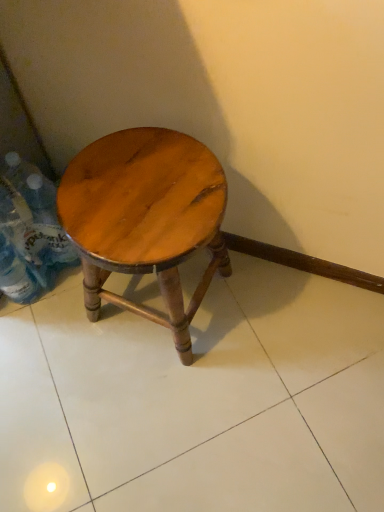
This screenshot has height=512, width=384. What do you see at coordinates (145, 218) in the screenshot? I see `wooden stool at center` at bounding box center [145, 218].

Locate an element on the screen. The width and height of the screenshot is (384, 512). wooden stool at center is located at coordinates (145, 218).

Image resolution: width=384 pixels, height=512 pixels. What do you see at coordinates (24, 234) in the screenshot? I see `translucent plastic bottle at left` at bounding box center [24, 234].

You are a GUI agent. You are given a task and a screenshot of the screen. Output one action in this format:
    pyautogui.click(x=<x>, y=<y>)
    Task: Click on the translucent plastic bottle at left
    Image resolution: width=384 pixels, height=512 pixels.
    Given the screenshot: What is the action you would take?
    pyautogui.click(x=24, y=234)

Measure the distance between translucent plastic bottle at left and camera.

translucent plastic bottle at left is 35.61 inches from camera.

Where is `wooden stool at center`? The width and height of the screenshot is (384, 512). wooden stool at center is located at coordinates (145, 218).

Is translucent plastic bottle at left to the right of wooden stool at center from the viewer's perspective?

Incorrect, translucent plastic bottle at left is not on the right side of wooden stool at center.

Which object is closer to the camera, translucent plastic bottle at left or wooden stool at center?

Positioned in front is wooden stool at center.

Does point (20, 224) come in front of point (116, 144)?

No.

Consider the image. From the image's perspective, is translucent plastic bottle at left above or below wooden stool at center?

translucent plastic bottle at left is above wooden stool at center.

Based on the photo, from a real-world perspective, which object stands above the other?

From a 3D spatial view, wooden stool at center is above.

Considering the sizes of objects translucent plastic bottle at left and wooden stool at center in the image provided, who is wider, translucent plastic bottle at left or wooden stool at center?

Wider between the two is wooden stool at center.

Between translucent plastic bottle at left and wooden stool at center, which one has less height?

Standing shorter between the two is translucent plastic bottle at left.

Can you confirm if translucent plastic bottle at left is smaller than wooden stool at center?

A: Indeed, translucent plastic bottle at left has a smaller size compared to wooden stool at center.

From the picture: Is translucent plastic bottle at left outside of wooden stool at center?

translucent plastic bottle at left lies outside wooden stool at center's area.

In the scene shown: Can you see translucent plastic bottle at left touching wooden stool at center?

translucent plastic bottle at left is not next to wooden stool at center, and they're not touching.

From the picture: Is wooden stool at center at the back of translucent plastic bottle at left?

No, wooden stool at center is not at the back of translucent plastic bottle at left.

The image size is (384, 512). What are the coordinates of `bottle to the left of wooden stool at center` in the screenshot? It's located at (24, 234).

Is wooden stool at center to the right of translucent plastic bottle at left from the viewer's perspective?

Indeed, wooden stool at center is positioned on the right side of translucent plastic bottle at left.

Is wooden stool at center closer to the viewer compared to translucent plastic bottle at left?

Yes, wooden stool at center is in front of translucent plastic bottle at left.

Does point (210, 216) come behind point (51, 284)?

No, it is in front of (51, 284).

From the image's perspective, which is below, wooden stool at center or translucent plastic bottle at left?

From the image's view, wooden stool at center is below.

From a real-world perspective, between wooden stool at center and translucent plastic bottle at left, who is vertically lower?

translucent plastic bottle at left, from a real-world perspective.

Does wooden stool at center have a lesser width compared to translucent plastic bottle at left?

No, wooden stool at center is not thinner than translucent plastic bottle at left.

Is wooden stool at center taller or shorter than translucent plastic bottle at left?

wooden stool at center is taller than translucent plastic bottle at left.

Can you confirm if wooden stool at center is bigger than translucent plastic bottle at left?

Yes, wooden stool at center is bigger than translucent plastic bottle at left.

Looking at this image, can translucent plastic bottle at left be found inside wooden stool at center?

No, translucent plastic bottle at left is not surrounded by wooden stool at center.

Are wooden stool at center and translucent plastic bottle at left located far from each other?

Actually, wooden stool at center and translucent plastic bottle at left are a little close together.

Does wooden stool at center turn towards translucent plastic bottle at left?

No, wooden stool at center does not turn towards translucent plastic bottle at left.

How distant is wooden stool at center from translucent plastic bottle at left?

wooden stool at center is 12.05 inches from translucent plastic bottle at left.

Where is `stool that is above the translucent plastic bottle at left (from a real-world perspective)`? stool that is above the translucent plastic bottle at left (from a real-world perspective) is located at coordinates [x=145, y=218].

Where is `stool on the right of translucent plastic bottle at left`? This screenshot has width=384, height=512. stool on the right of translucent plastic bottle at left is located at coordinates (145, 218).

Where is `bottle lying above the wooden stool at center (from the image's perspective)`? Image resolution: width=384 pixels, height=512 pixels. bottle lying above the wooden stool at center (from the image's perspective) is located at coordinates (24, 234).